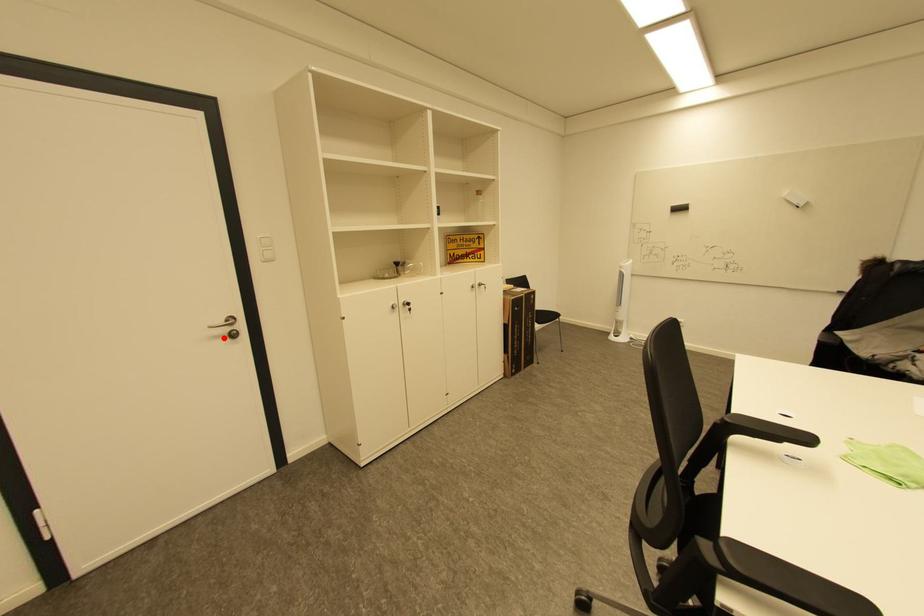
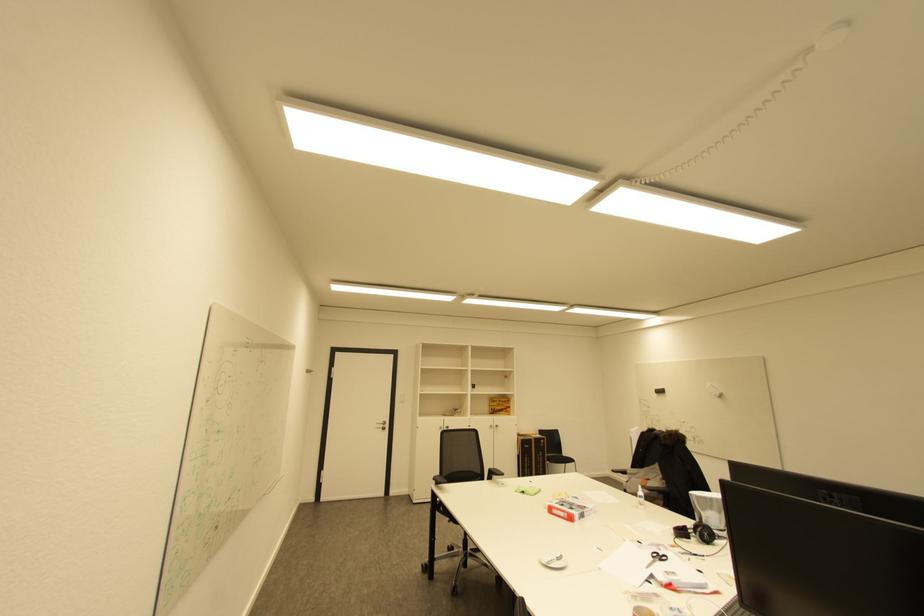
In the second image, find the point that corresponds to the highlighted location in the first image.

(385, 429)